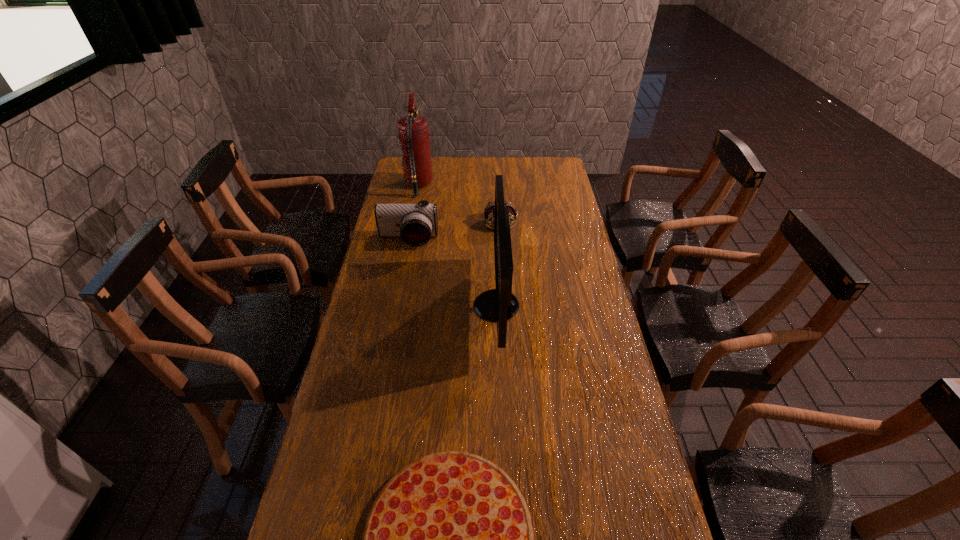
Where is `vacant region between the camcorder and the computer monitor`? vacant region between the camcorder and the computer monitor is located at coordinates (452, 273).

Where is `free area in between the third shortest object and the computer monitor`? Image resolution: width=960 pixels, height=540 pixels. free area in between the third shortest object and the computer monitor is located at coordinates (452, 273).

You are a GUI agent. You are given a task and a screenshot of the screen. Output one action in this format:
    pyautogui.click(x=<x>, y=<y>)
    Task: Click on the vacant space that's between the camcorder and the crown
    The height and width of the screenshot is (540, 960).
    Given the screenshot: What is the action you would take?
    pyautogui.click(x=454, y=231)

The width and height of the screenshot is (960, 540). What are the coordinates of `object identified as the third closest to the fourth tallest object` in the screenshot? It's located at point(413,130).

Where is `the fourth closest object relative to the fourth farthest object`? The height and width of the screenshot is (540, 960). the fourth closest object relative to the fourth farthest object is located at coordinates (413, 130).

At what (x,y) coordinates should I click in order to perform the action: click on free space that satisfies the following two spatial constraints: 1. on the back side of the second shortest object; 2. at the front of the fire extinguisher where the nozzle is aimed. Please return your answer as a coordinate pair (x, y). Image resolution: width=960 pixels, height=540 pixels. Looking at the image, I should click on (498, 185).

Locate an element on the screen. The width and height of the screenshot is (960, 540). free space that satisfies the following two spatial constraints: 1. on the front side of the fourth tallest object; 2. on the front-facing side of the computer monitor is located at coordinates (505, 306).